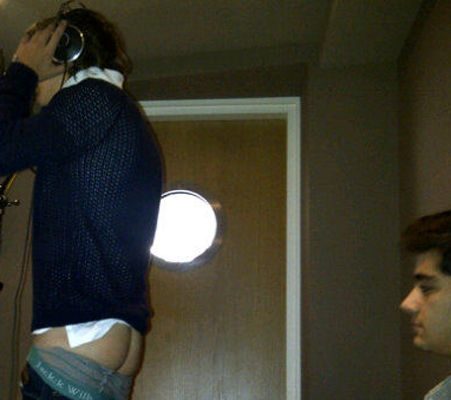
Locate an element on the screen. This screenshot has height=400, width=451. door is located at coordinates (274, 318).